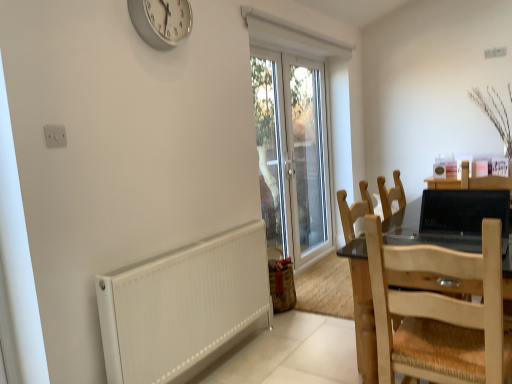
Question: Is light brown wooden chair at right, which is counted as the first chair, starting from the back, inside black glossy laptop at right?

Choices:
 (A) no
 (B) yes

Answer: (A)

Question: Does black glossy laptop at right have a lesser width compared to light brown wooden chair at right, which is counted as the 2th chair, starting from the front?

Choices:
 (A) yes
 (B) no

Answer: (A)

Question: From a real-world perspective, is black glossy laptop at right on light brown wooden chair at right, which is counted as the 2th chair, starting from the front?

Choices:
 (A) yes
 (B) no

Answer: (A)

Question: Could you tell me if black glossy laptop at right is facing light brown wooden chair at right, which is counted as the first chair, starting from the back?

Choices:
 (A) no
 (B) yes

Answer: (A)

Question: Is black glossy laptop at right outside of light brown wooden chair at right, which is counted as the 2th chair, starting from the front?

Choices:
 (A) yes
 (B) no

Answer: (A)

Question: From the image's perspective, is black glossy laptop at right beneath light brown wooden chair at right, which is counted as the first chair, starting from the back?

Choices:
 (A) no
 (B) yes

Answer: (A)

Question: Is silver metallic clock at upper center wider than light brown wooden chair at right, which is counted as the 2th chair, starting from the front?

Choices:
 (A) yes
 (B) no

Answer: (B)

Question: Is silver metallic clock at upper center smaller than light brown wooden chair at right, which is counted as the 2th chair, starting from the front?

Choices:
 (A) yes
 (B) no

Answer: (A)

Question: Is silver metallic clock at upper center next to light brown wooden chair at right, which is counted as the 2th chair, starting from the front?

Choices:
 (A) no
 (B) yes

Answer: (A)

Question: Is silver metallic clock at upper center behind light brown wooden chair at right, which is counted as the first chair, starting from the back?

Choices:
 (A) yes
 (B) no

Answer: (B)

Question: Considering the relative sizes of silver metallic clock at upper center and light brown wooden chair at right, which is counted as the first chair, starting from the back, in the image provided, is silver metallic clock at upper center shorter than light brown wooden chair at right, which is counted as the first chair, starting from the back,?

Choices:
 (A) no
 (B) yes

Answer: (B)

Question: Is silver metallic clock at upper center facing towards light brown wooden chair at right, which is counted as the first chair, starting from the back?

Choices:
 (A) no
 (B) yes

Answer: (A)

Question: Is natural wood chair at right, arranged as the second chair when viewed from the back, looking in the opposite direction of black glossy laptop at right?

Choices:
 (A) yes
 (B) no

Answer: (B)